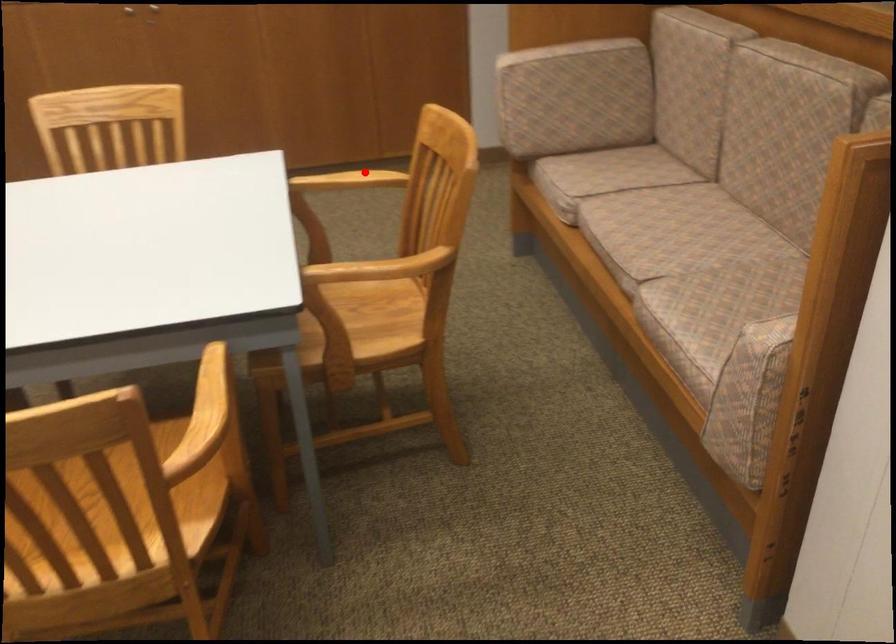
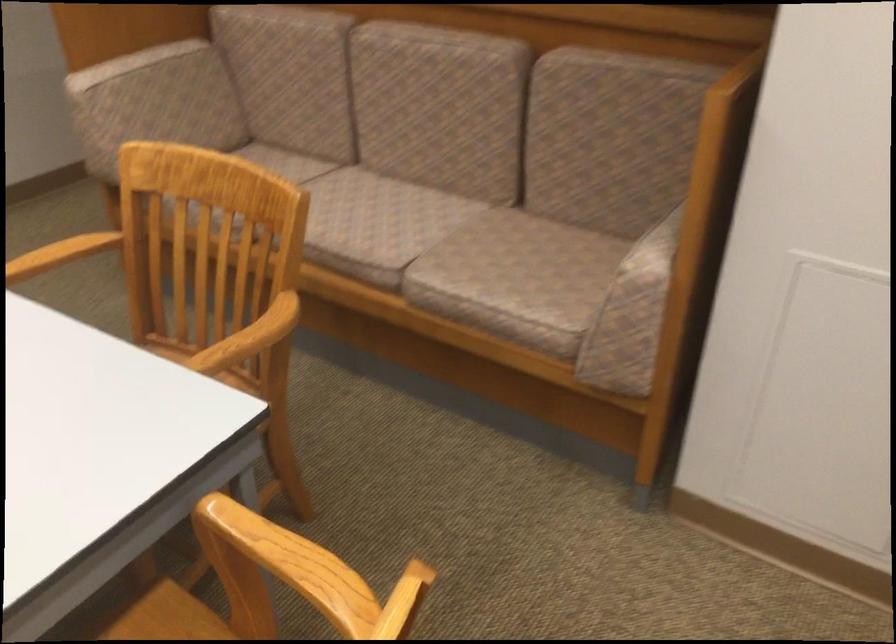
Question: I am providing you with two images of the same scene from different viewpoints. A red point is shown in image1. For the corresponding object point in image2, is it positioned nearer or farther from the camera?

Choices:
 (A) Nearer
 (B) Farther

Answer: (A)